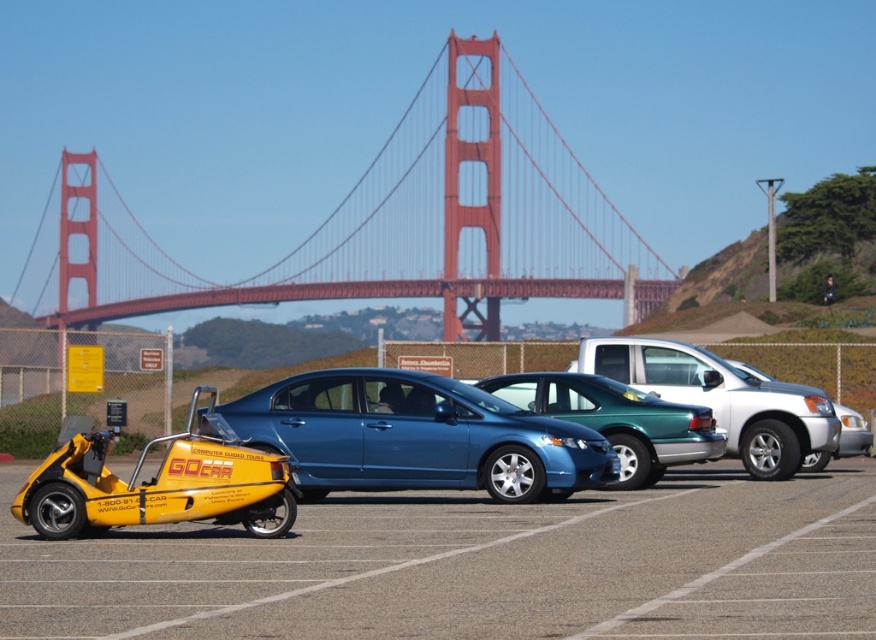
Does red metal bridge at center have a smaller size compared to metallic blue sedan at center?

No.

Is red metal bridge at center above metallic blue sedan at center?

Yes, red metal bridge at center is above metallic blue sedan at center.

Identify the location of red metal bridge at center. Image resolution: width=876 pixels, height=640 pixels. (380, 221).

Locate an element on the screen. The height and width of the screenshot is (640, 876). red metal bridge at center is located at coordinates (380, 221).

Can you confirm if yellow matte gocar at lower left is bigger than red metal bridge at center?

Incorrect, yellow matte gocar at lower left is not larger than red metal bridge at center.

Is yellow matte gocar at lower left to the left of red metal bridge at center from the viewer's perspective?

Incorrect, yellow matte gocar at lower left is not on the left side of red metal bridge at center.

Who is more forward, (705, 483) or (500, 280)?

Point (705, 483) is in front.

Image resolution: width=876 pixels, height=640 pixels. What are the coordinates of `yellow matte gocar at lower left` in the screenshot? It's located at (474, 566).

Is point (348, 417) in front of point (822, 422)?

Yes.

You are a GUI agent. You are given a task and a screenshot of the screen. Output one action in this format:
    pyautogui.click(x=<x>, y=<y>)
    Task: Click on the metallic blue sedan at center
    The image size is (876, 640).
    Given the screenshot: What is the action you would take?
    pyautogui.click(x=415, y=436)